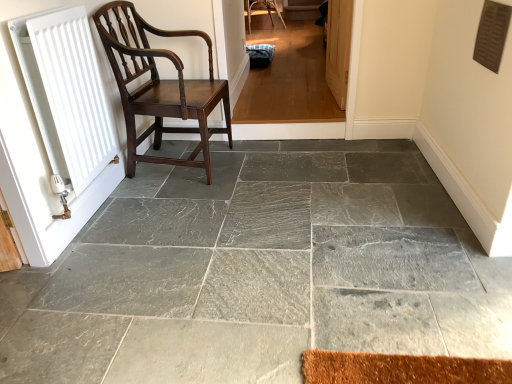
Question: Can you confirm if dark wood chair at left is positioned to the right of gray stone floor at center?

Choices:
 (A) no
 (B) yes

Answer: (A)

Question: From a real-world perspective, is dark wood chair at left under gray stone floor at center?

Choices:
 (A) no
 (B) yes

Answer: (A)

Question: Does dark wood chair at left come in front of gray stone floor at center?

Choices:
 (A) no
 (B) yes

Answer: (A)

Question: Does dark wood chair at left have a lesser height compared to gray stone floor at center?

Choices:
 (A) no
 (B) yes

Answer: (A)

Question: Is there a large distance between dark wood chair at left and gray stone floor at center?

Choices:
 (A) no
 (B) yes

Answer: (A)

Question: In terms of width, does white matte radiator at left look wider or thinner when compared to wooden screen door at upper right?

Choices:
 (A) wide
 (B) thin

Answer: (A)

Question: Relative to wooden screen door at upper right, is white matte radiator at left in front or behind?

Choices:
 (A) front
 (B) behind

Answer: (A)

Question: Is white matte radiator at left spatially inside wooden screen door at upper right, or outside of it?

Choices:
 (A) inside
 (B) outside

Answer: (B)

Question: Considering the relative positions of white matte radiator at left and wooden screen door at upper right in the image provided, is white matte radiator at left to the left or to the right of wooden screen door at upper right?

Choices:
 (A) right
 (B) left

Answer: (B)

Question: Considering the positions of gray stone floor at center and wooden screen door at upper right in the image, is gray stone floor at center wider or thinner than wooden screen door at upper right?

Choices:
 (A) wide
 (B) thin

Answer: (A)

Question: Considering the positions of point (415, 208) and point (347, 52), is point (415, 208) closer or farther from the camera than point (347, 52)?

Choices:
 (A) farther
 (B) closer

Answer: (B)

Question: In terms of size, does gray stone floor at center appear bigger or smaller than wooden screen door at upper right?

Choices:
 (A) small
 (B) big

Answer: (B)

Question: From a real-world perspective, is gray stone floor at center physically located above or below wooden screen door at upper right?

Choices:
 (A) above
 (B) below

Answer: (B)

Question: From a real-world perspective, is dark wood chair at left physically located above or below gray stone floor at center?

Choices:
 (A) below
 (B) above

Answer: (B)

Question: Is dark wood chair at left inside or outside of gray stone floor at center?

Choices:
 (A) inside
 (B) outside

Answer: (B)